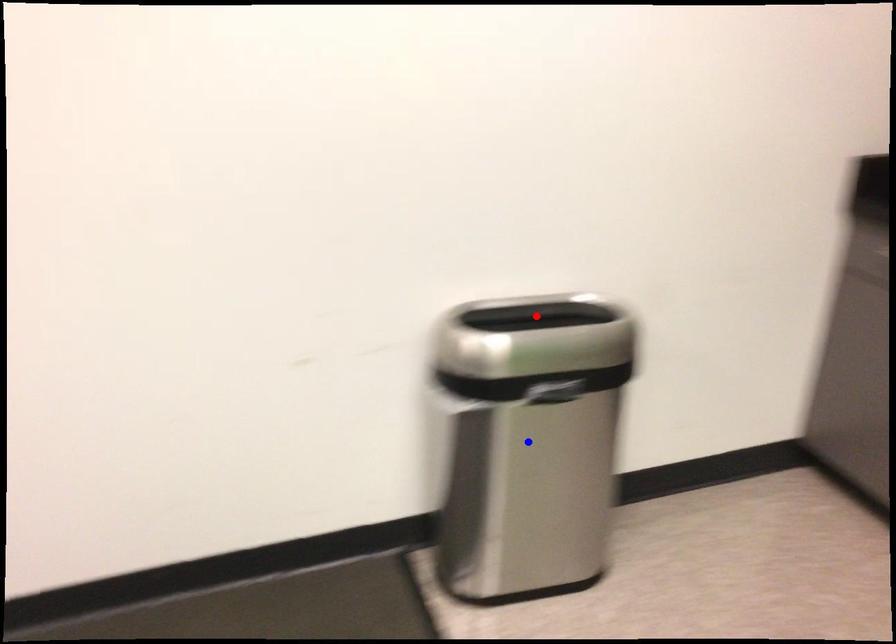
Question: In the image, two points are highlighted. Which point is nearer to the camera? Reply with the corresponding letter.

Choices:
 (A) blue point
 (B) red point

Answer: (A)